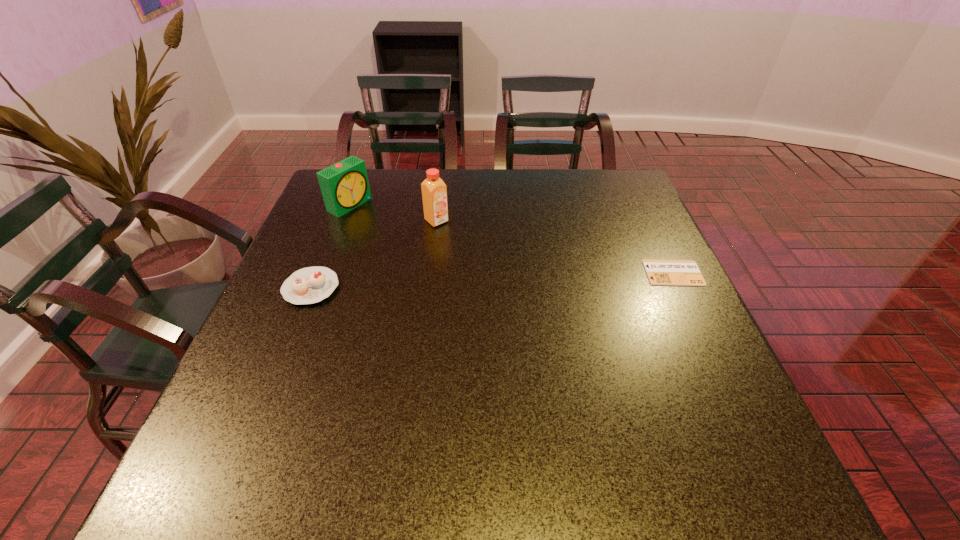
The width and height of the screenshot is (960, 540). What are the coordinates of `free space between the shortest object and the second shortest object` in the screenshot? It's located at (492, 280).

Find the location of a particular element. This screenshot has height=540, width=960. free spot between the second shortest object and the third object from left to right is located at coordinates (374, 254).

The height and width of the screenshot is (540, 960). What are the coordinates of `unoccupied area between the tallest object and the rightmost object` in the screenshot? It's located at (555, 247).

Find the location of a particular element. vacant area between the rightmost object and the cupcake is located at coordinates (492, 280).

In order to click on object that is the nearest to the cupcake in this screenshot , I will do `click(344, 185)`.

Identify the location of object identified as the third closest to the shortest object. The height and width of the screenshot is (540, 960). (344, 185).

Find the location of `vacant area in the image that satisfies the following two spatial constraints: 1. on the back side of the second object from right to left; 2. on the left side of the cupcake`. vacant area in the image that satisfies the following two spatial constraints: 1. on the back side of the second object from right to left; 2. on the left side of the cupcake is located at coordinates (338, 221).

Identify the location of free region that satisfies the following two spatial constraints: 1. on the back side of the cupcake; 2. on the right side of the alarm clock. (345, 205).

The width and height of the screenshot is (960, 540). I want to click on free point that satisfies the following two spatial constraints: 1. on the back side of the third shortest object; 2. on the right side of the second shortest object, so click(x=345, y=205).